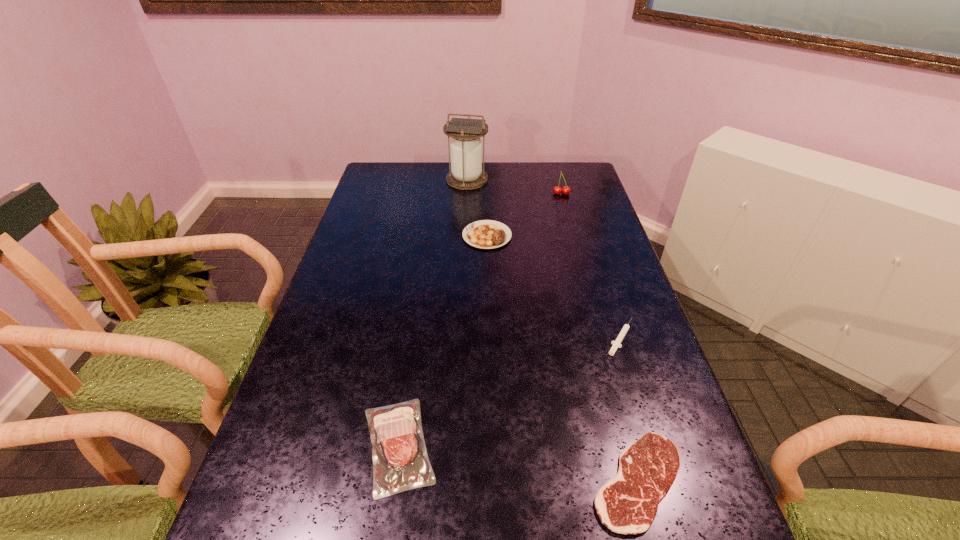
The image size is (960, 540). Find the location of `cherry that is at the right edge`. cherry that is at the right edge is located at coordinates (557, 190).

This screenshot has height=540, width=960. What are the coordinates of `syringe present at the right edge` in the screenshot? It's located at (616, 344).

Identify the location of steak situated at the right edge. The height and width of the screenshot is (540, 960). (627, 504).

Where is `object located at the far right corner`? This screenshot has width=960, height=540. object located at the far right corner is located at coordinates (557, 190).

What are the coordinates of `vacant space at the far edge of the desktop` in the screenshot? It's located at (422, 178).

You are a GUI agent. You are given a task and a screenshot of the screen. Output one action in this format:
    pyautogui.click(x=<x>, y=<y>)
    Task: Click on the vacant space at the left edge of the desktop
    
    Given the screenshot: What is the action you would take?
    pyautogui.click(x=403, y=206)

Find the location of a particular element. The width and height of the screenshot is (960, 540). vacant space at the right edge is located at coordinates click(641, 350).

The image size is (960, 540). I want to click on vacant region at the far left corner of the desktop, so click(x=401, y=170).

The image size is (960, 540). What are the coordinates of `free location at the far right corner` in the screenshot? It's located at (561, 185).

The image size is (960, 540). I want to click on unoccupied area between the second steak from left to right and the third shortest object, so click(x=443, y=341).